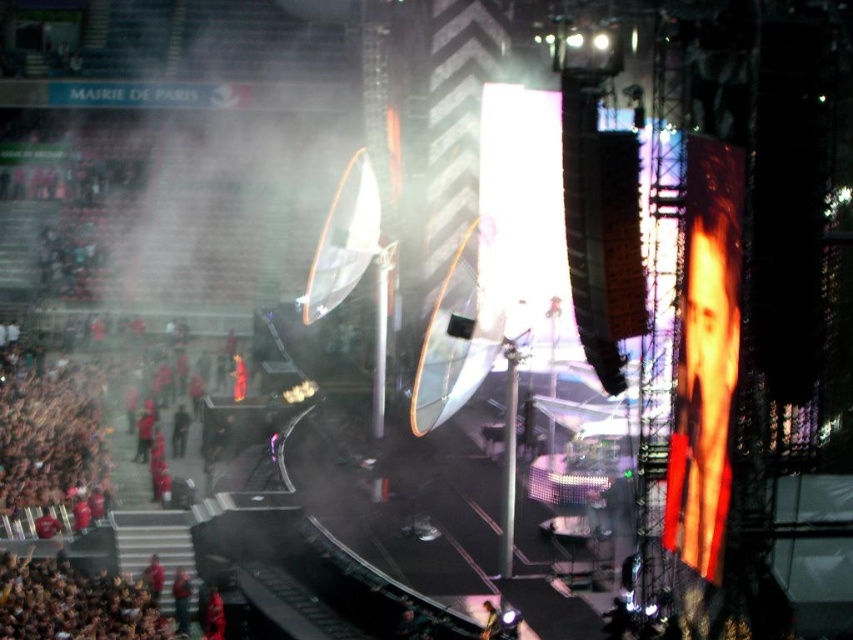
Question: Which of the following is the closest to the observer?

Choices:
 (A) shiny black guitar at center
 (B) red fabric jacket at lower left

Answer: (A)

Question: Which of the following is the farthest from the observer?

Choices:
 (A) (186, 634)
 (B) (207, 592)
 (C) (491, 625)

Answer: (B)

Question: Is red fabric person at lower left thinner than shiny black guitar at center?

Choices:
 (A) yes
 (B) no

Answer: (B)

Question: Does red fabric person at lower left have a greater width compared to shiny black guitar at center?

Choices:
 (A) yes
 (B) no

Answer: (A)

Question: Which object appears closest to the camera in this image?

Choices:
 (A) red fabric person at lower left
 (B) red fabric jacket at lower left

Answer: (A)

Question: Can you confirm if red fabric person at lower left is positioned to the right of shiny black guitar at center?

Choices:
 (A) yes
 (B) no

Answer: (B)